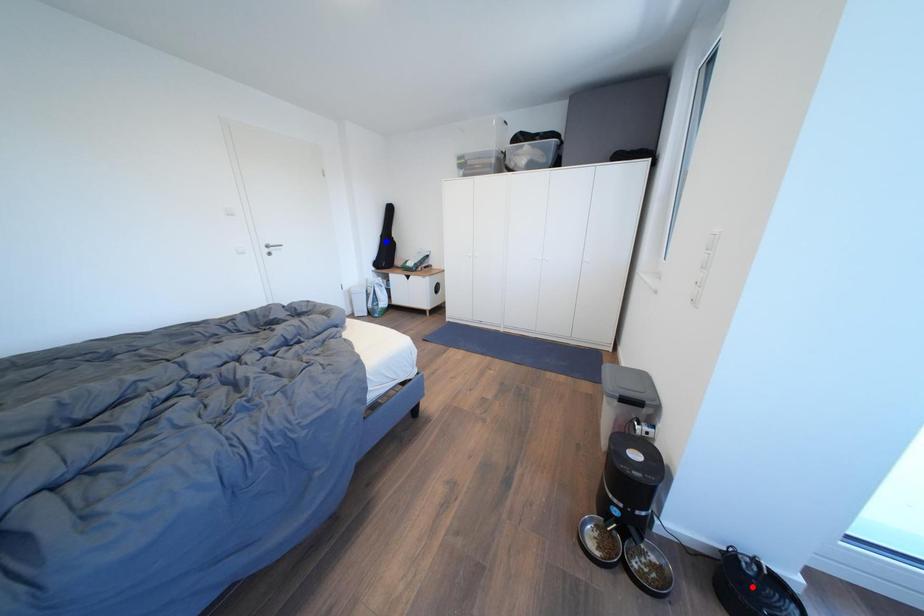
Question: Which of the two points in the image is closer to the camera?

Choices:
 (A) Blue point is closer.
 (B) Red point is closer.

Answer: (B)